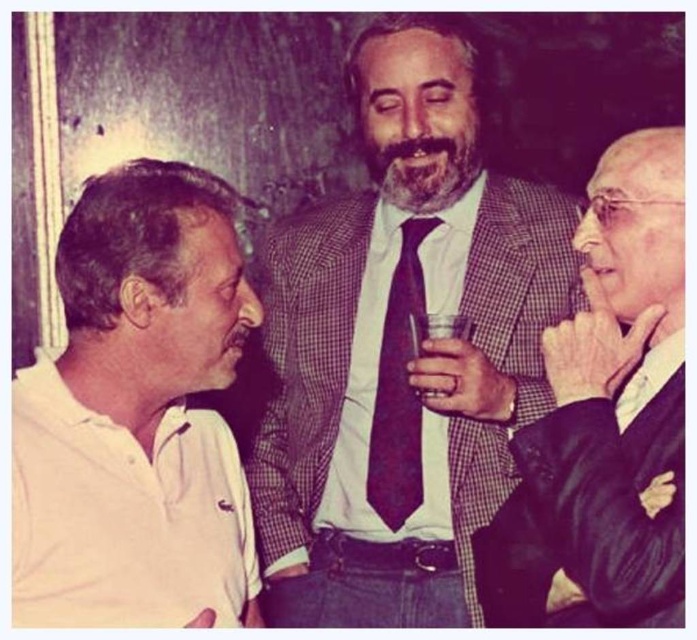
Question: Does white cotton polo shirt at left appear on the right side of maroon silk tie at center?

Choices:
 (A) no
 (B) yes

Answer: (A)

Question: Which point is closer to the camera?

Choices:
 (A) checkered wool suit at center
 (B) maroon silk tie at center

Answer: (A)

Question: Which is nearer to the white cotton polo shirt at left?

Choices:
 (A) clear plastic cup at center
 (B) checkered wool suit at center

Answer: (B)

Question: Does checkered wool suit at center lie in front of maroon silk tie at center?

Choices:
 (A) yes
 (B) no

Answer: (A)

Question: Is checkered wool suit at center above clear plastic cup at center?

Choices:
 (A) yes
 (B) no

Answer: (A)

Question: Estimate the real-world distances between objects in this image. Which object is farther from the beardsoft/hairyat center?

Choices:
 (A) checkered wool suit at center
 (B) white cotton polo shirt at left
 (C) black leather jacket at right
 (D) maroon silk tie at center

Answer: (B)